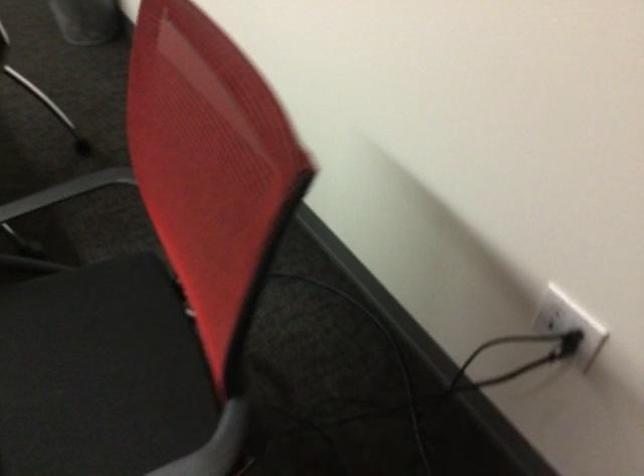
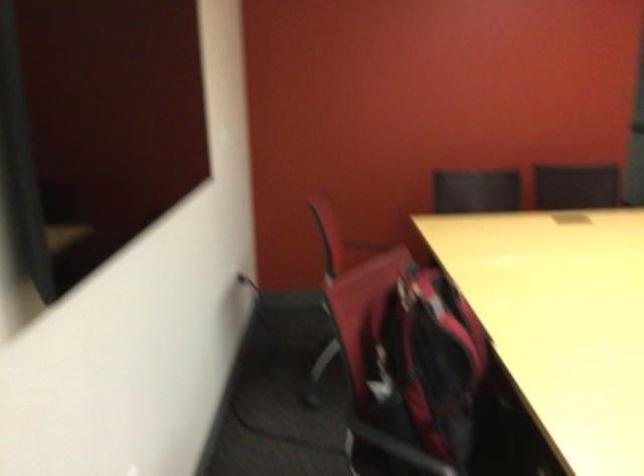
Question: I am providing you with two images of the same scene from different viewpoints. After the viewpoint changes to image2, which objects are now occluded?

Choices:
 (A) black chair armrest
 (B) chair armrest
 (C) large terracotta pot
 (D) red and black backpack

Answer: (B)